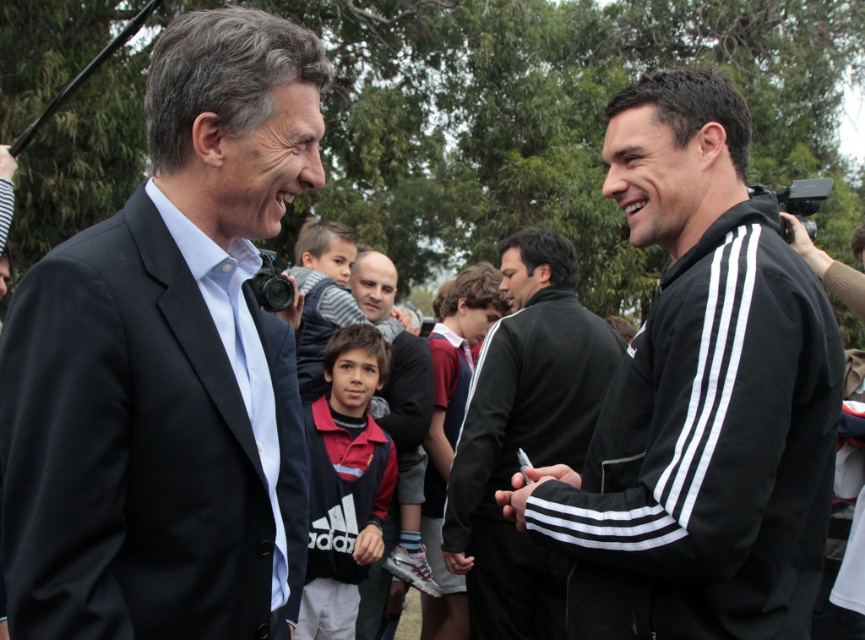
Who is taller, black matte suit at left or black matte jacket at center?

black matte jacket at center

Does point (193, 550) come behind point (556, 445)?

No, it is in front of (556, 445).

Is point (178, 202) positioned before point (471, 563)?

That is True.

I want to click on black matte suit at left, so click(x=162, y=360).

Does black adidas tracksuit at right have a lesser height compared to red adidas bib at center?

No, black adidas tracksuit at right is not shorter than red adidas bib at center.

Who is more distant from viewer, (714,122) or (364,324)?

The point (364,324) is more distant.

This screenshot has height=640, width=865. In order to click on black adidas tracksuit at right in this screenshot , I will do `click(699, 397)`.

Is red adidas bib at center closer to camera compared to dark brown leather jacket at center?

Yes.

Between red adidas bib at center and dark brown leather jacket at center, which one has less height?

red adidas bib at center

What are the coordinates of `red adidas bib at center` in the screenshot? It's located at (346, 483).